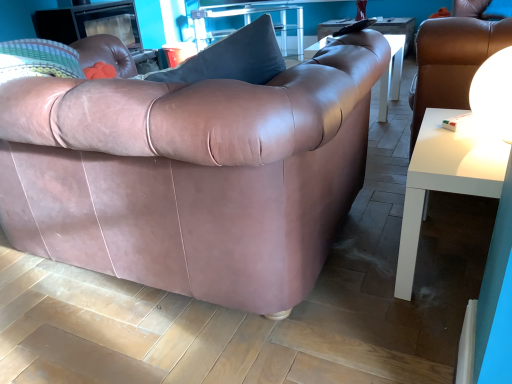
Question: Considering the positions of point (206, 84) and point (437, 110), is point (206, 84) closer or farther from the camera than point (437, 110)?

Choices:
 (A) closer
 (B) farther

Answer: (A)

Question: Based on their positions, is matte leather couch at center located to the left or right of white glossy table at lower right, which is counted as the 2th table, starting from the left?

Choices:
 (A) left
 (B) right

Answer: (A)

Question: Based on their relative distances, which object is farther from the clear glass table at upper center, the 1th table from the top?

Choices:
 (A) white glossy side table at right
 (B) white glossy sphere at upper right
 (C) matte leather couch at center
 (D) white glossy table at lower right, acting as the first table starting from the bottom

Answer: (B)

Question: Based on their relative distances, which object is nearer to the matte leather couch at center?

Choices:
 (A) clear glass table at upper center, marked as the second table in a front-to-back arrangement
 (B) white glossy sphere at upper right
 (C) white glossy table at lower right, arranged as the second table when viewed from the top
 (D) white glossy side table at right

Answer: (C)